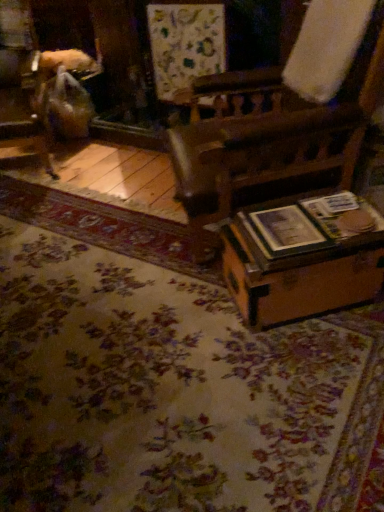
The image size is (384, 512). I want to click on blank space above floral carpet at center (from a real-world perspective), so click(116, 304).